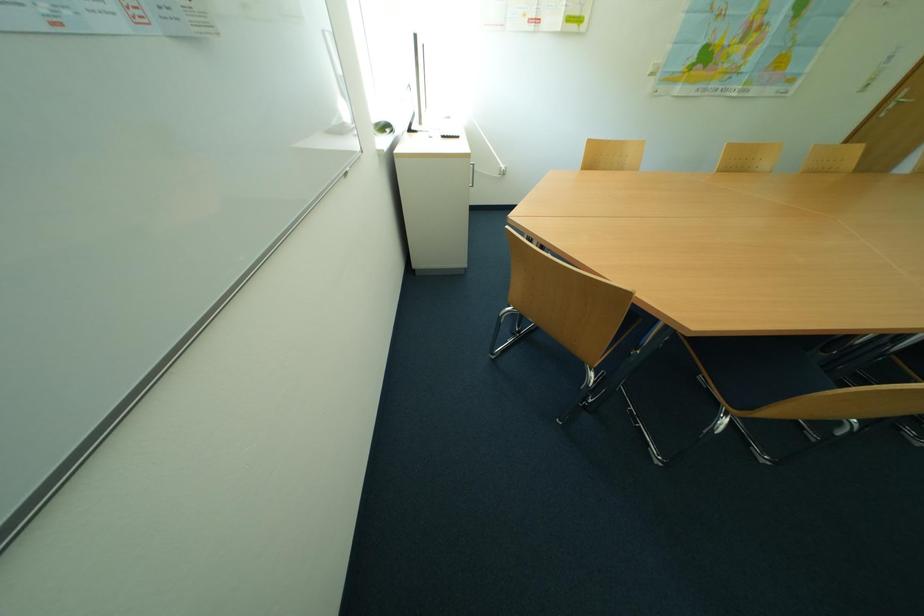
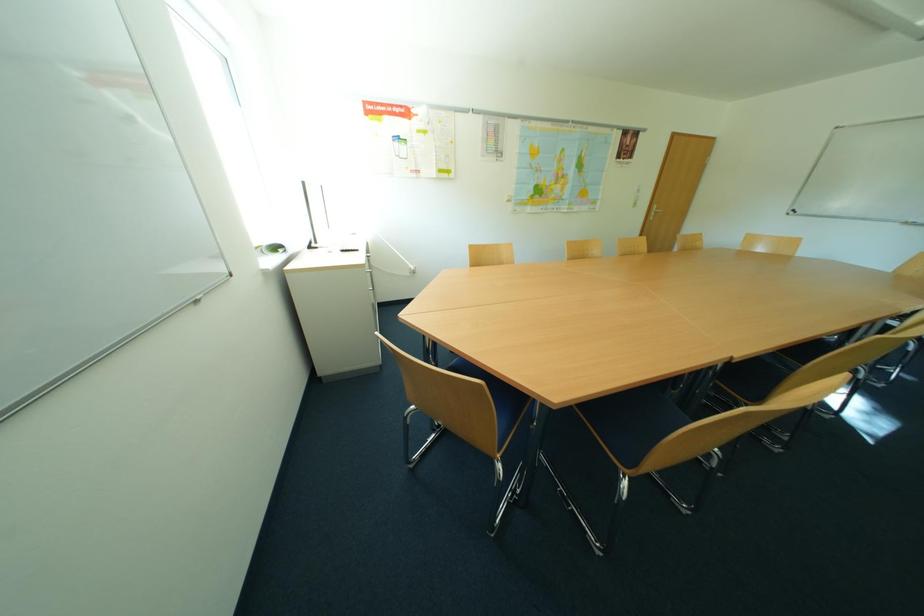
Question: The first image is from the beginning of the video and the second image is from the end. How did the camera likely rotate when shooting the video?

Choices:
 (A) Left
 (B) Right
 (C) Up
 (D) Down

Answer: (C)